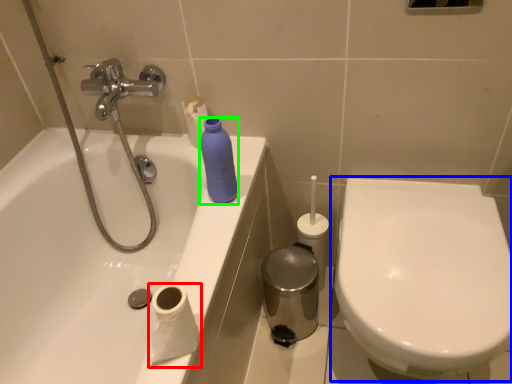
Question: Which object is positioned closest to toilet paper (highlighted by a red box)? Select from toilet (highlighted by a blue box) and cleaning product (highlighted by a green box).

Choices:
 (A) toilet
 (B) cleaning product

Answer: (B)